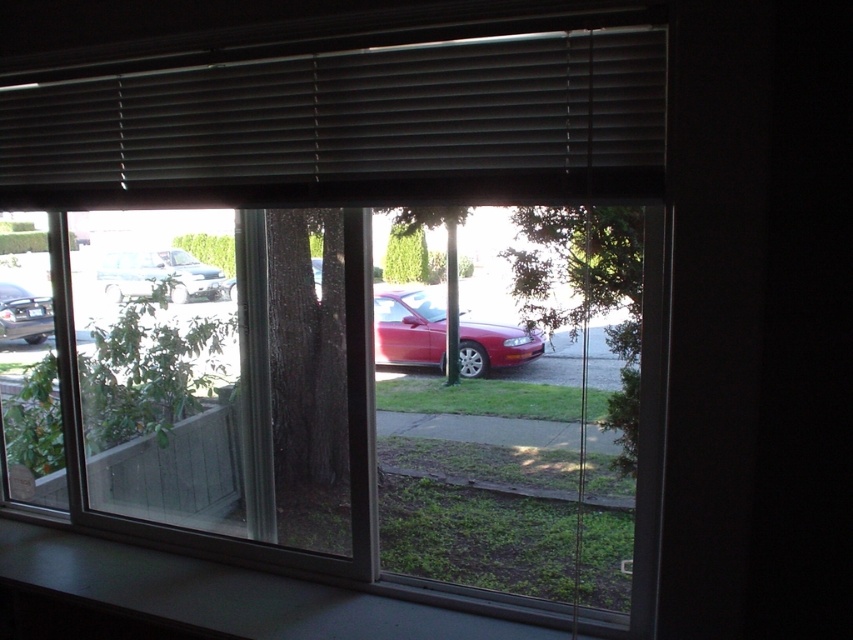
You are standing inside a room looking through the window. You see the green leafy tree at center and the shiny black sedan at left. Which object is closer to you through the window?

The green leafy tree at center is closer to you because it is in front of the shiny black sedan at left.

You are an interior designer assessing the lighting in a room. You notice the matte gray blinds at top and the matte silver sedan at left. Which object is shorter in height?

The matte gray blinds at top has a lesser height compared to the matte silver sedan at left, so the matte gray blinds at top is shorter in height.

You are a window cleaner standing 10 feet away from the window. You have a 6 foot ladder that you can lean against the wall. The ladder can extend to its full length. The window is 10 feet high. Can you reach both the matte gray blinds at top and the matte silver sedan at left with the ladder?

The matte gray blinds at top and matte silver sedan at left are 5.28 feet apart. Since the ladder is 6 feet long, which is longer than the distance between them, you can reach both by positioning the ladder appropriately between them.